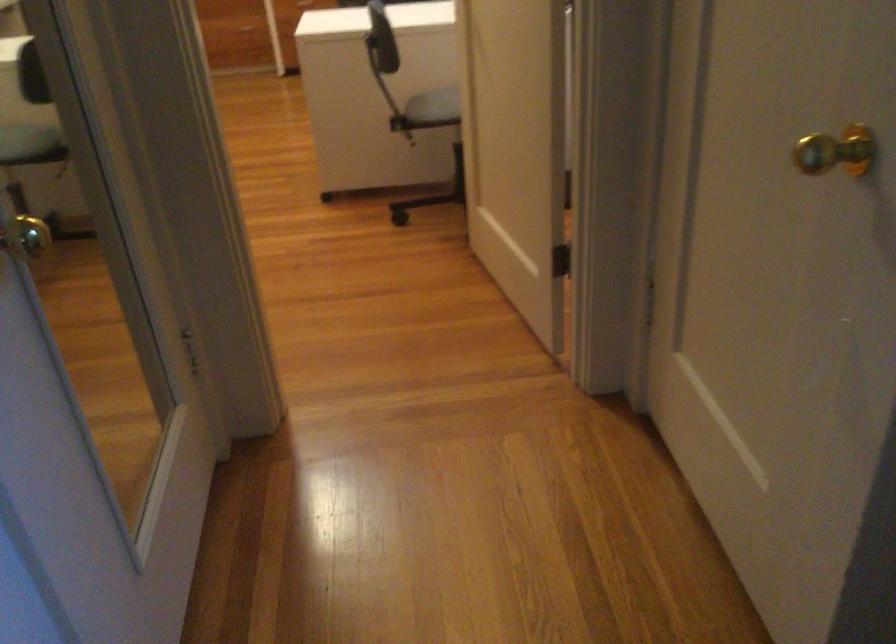
The image size is (896, 644). Find the location of `black chair armrest`. black chair armrest is located at coordinates (382, 39).